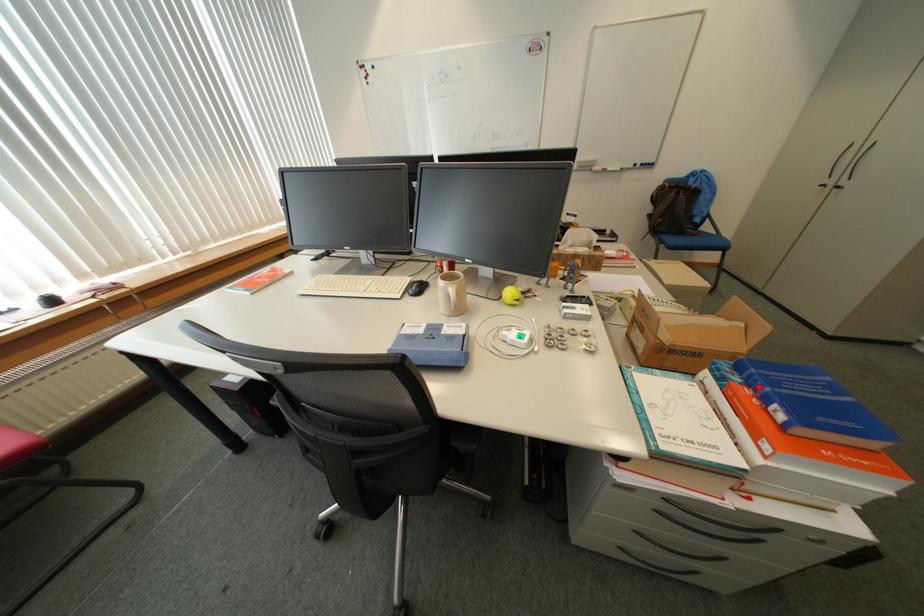
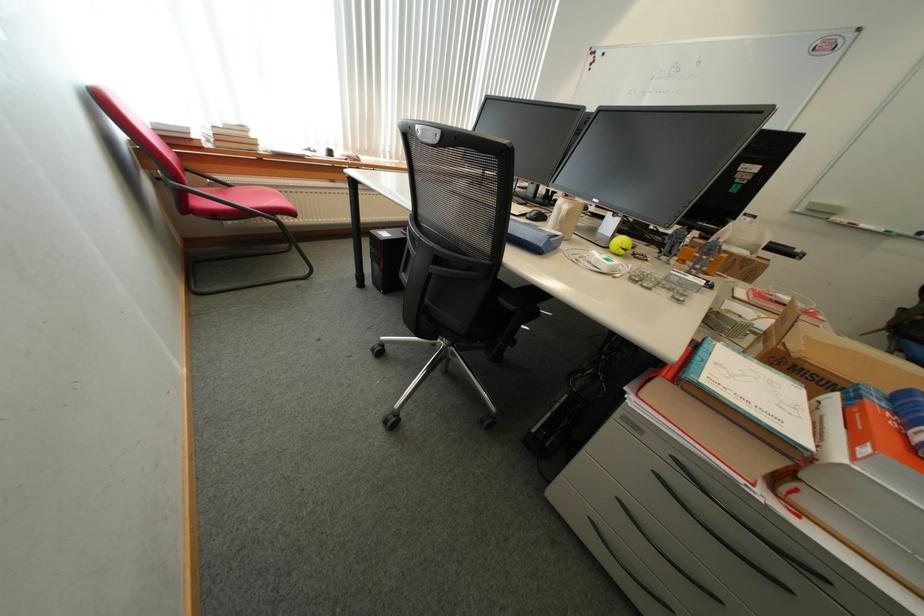
Question: I am providing you with two images of the same scene from different viewpoints. Given a red point in image1, look at the same physical point in image2. Is it:

Choices:
 (A) Closer to the viewpoint
 (B) Farther from the viewpoint

Answer: (A)